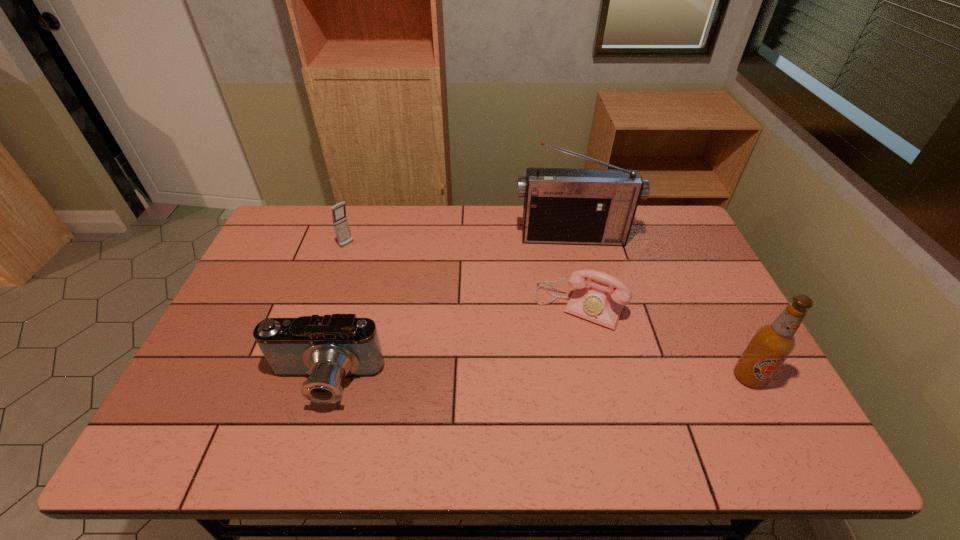
Identify the location of free point located 0.190m on the front-facing side of the cellular telephone. coord(387,275).

The height and width of the screenshot is (540, 960). What are the coordinates of `vacant space located on the front-facing side of the cellular telephone` in the screenshot? It's located at (383, 272).

The width and height of the screenshot is (960, 540). Find the location of `vacant space located on the front-facing side of the cellular telephone`. vacant space located on the front-facing side of the cellular telephone is located at coordinates (368, 260).

You are a GUI agent. You are given a task and a screenshot of the screen. Output one action in this format:
    pyautogui.click(x=<x>, y=<y>)
    Task: Click on the vacant space situated 0.110m on the dial of the third nearest object
    The height and width of the screenshot is (540, 960).
    Given the screenshot: What is the action you would take?
    pyautogui.click(x=548, y=357)

The image size is (960, 540). Identify the location of free space located on the dial of the third nearest object. (545, 363).

Identify the location of free region located 0.260m on the dial of the third nearest object. (524, 404).

Identify the location of radio receiver at the far edge. This screenshot has height=540, width=960. [571, 206].

The image size is (960, 540). Identify the location of cellular telephone present at the far edge. (340, 222).

At what (x,y) coordinates should I click in order to perform the action: click on camcorder that is at the near edge. Please return your answer as a coordinate pair (x, y). The height and width of the screenshot is (540, 960). Looking at the image, I should click on (326, 349).

Locate an element on the screen. The height and width of the screenshot is (540, 960). beer bottle positioned at the near edge is located at coordinates (772, 344).